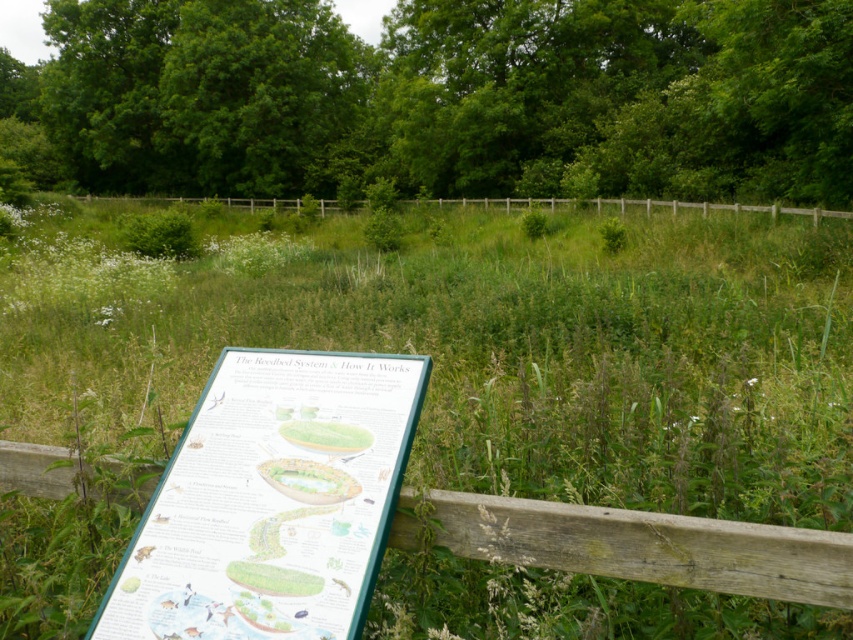
Does point (59, 76) come closer to viewer compared to point (212, 160)?

No, it is behind (212, 160).

Is the position of green leafy tree at center less distant than that of green leafy tree at upper left?

Yes, it is.

From the picture: Who is more distant from viewer, (328, 156) or (199, 102)?

The point (328, 156) is behind.

This screenshot has height=640, width=853. Identify the location of green leafy tree at center. (444, 99).

Does green leafy tree at center have a lesser width compared to green plastic sign at center?

No.

Between point (515, 44) and point (207, 541), which one is positioned behind?

The point (515, 44) is behind.

At what (x,y) coordinates should I click in order to perform the action: click on green leafy tree at center. Please return your answer as a coordinate pair (x, y). This screenshot has height=640, width=853. Looking at the image, I should click on (444, 99).

Is green grassy at center to the left of wooden fence at center from the viewer's perspective?

Incorrect, green grassy at center is not on the left side of wooden fence at center.

Does green grassy at center appear over wooden fence at center?

Actually, green grassy at center is below wooden fence at center.

Describe the element at coordinates (439, 362) in the screenshot. This screenshot has width=853, height=640. I see `green grassy at center` at that location.

Identify the location of green grassy at center. The height and width of the screenshot is (640, 853). (439, 362).